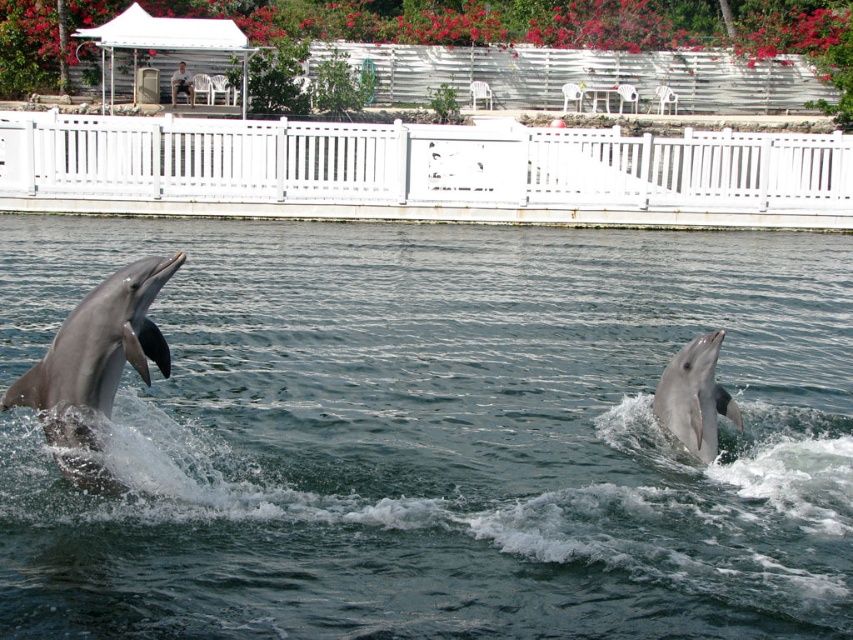
You are standing at the center of the viewing area and want to take a photo of the gray smooth dolphin at right. According to the coordinates provided, where should you aim your camera to capture it?

The gray smooth dolphin at right is located at point coordinates (694, 397), so you should aim your camera at those coordinates to capture it.

Based on the photo, you are a photographer trying to capture both the gray smooth dolphin at left and the gray smooth dolphin at right in a single shot. Based on their positions, which dolphin should you focus on first to ensure both are in frame?

Since the gray smooth dolphin at left is to the left of the gray smooth dolphin at right, you should focus on the gray smooth dolphin at left first to ensure both are within the frame.

You are a photographer standing behind the white picket fence trying to capture both the gray smooth dolphin at left and the gray smooth dolphin at right in one shot. Based on their positions, which dolphin will appear closer to the camera in your photo?

The gray smooth dolphin at left will appear closer to the camera because it is positioned in front of the gray smooth dolphin at right.